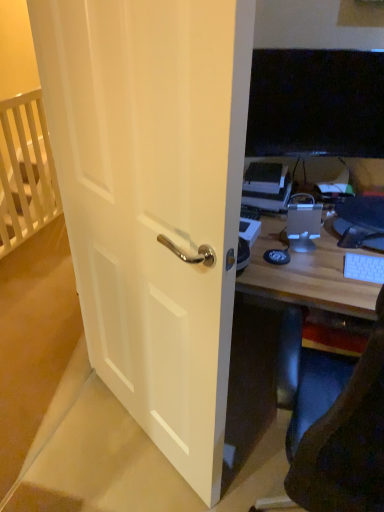
At what (x,y) coordinates should I click in order to perform the action: click on white wooden crib at upper left. Please return your answer as a coordinate pair (x, y). Image resolution: width=384 pixels, height=512 pixels. Looking at the image, I should click on (25, 170).

Image resolution: width=384 pixels, height=512 pixels. What do you see at coordinates (25, 170) in the screenshot?
I see `white wooden crib at upper left` at bounding box center [25, 170].

The image size is (384, 512). In order to click on black glossy monitor at upper right in this screenshot , I will do pyautogui.click(x=316, y=103).

Describe the element at coordinates (316, 103) in the screenshot. I see `black glossy monitor at upper right` at that location.

Where is `satin silver desktop at center`? The width and height of the screenshot is (384, 512). satin silver desktop at center is located at coordinates (303, 222).

Image resolution: width=384 pixels, height=512 pixels. In order to click on black rubber mousepad at center in this screenshot , I will do (x=277, y=256).

Can we say satin silver desktop at center lies outside white wooden crib at upper left?

satin silver desktop at center is positioned outside white wooden crib at upper left.

Identify the location of desktop computer on the right of white wooden crib at upper left. (303, 222).

From the image's perspective, which object appears higher, satin silver desktop at center or white wooden crib at upper left?

white wooden crib at upper left, from the image's perspective.

Which is more to the left, satin silver desktop at center or white wooden crib at upper left?

white wooden crib at upper left.

Considering the relative sizes of black glossy monitor at upper right and satin silver desktop at center in the image provided, is black glossy monitor at upper right bigger than satin silver desktop at center?

Yes.

Is black glossy monitor at upper right far from satin silver desktop at center?

No, black glossy monitor at upper right is not far from satin silver desktop at center.

Considering the positions of objects black glossy monitor at upper right and satin silver desktop at center in the image provided, who is behind, black glossy monitor at upper right or satin silver desktop at center?

black glossy monitor at upper right.

Is satin silver desktop at center inside black glossy monitor at upper right?

No, satin silver desktop at center is located outside of black glossy monitor at upper right.

From the image's perspective, between white wooden crib at upper left and satin silver desktop at center, who is located below?

From the image's view, satin silver desktop at center is below.

Are white wooden crib at upper left and satin silver desktop at center located far from each other?

Yes, white wooden crib at upper left is far from satin silver desktop at center.

Who is smaller, white wooden crib at upper left or satin silver desktop at center?

satin silver desktop at center.

Looking at this image, how far apart are white wooden crib at upper left and satin silver desktop at center?

white wooden crib at upper left and satin silver desktop at center are 6.43 feet apart from each other.

How distant is white plastic keyboard at right from white wooden crib at upper left?

A distance of 2.22 meters exists between white plastic keyboard at right and white wooden crib at upper left.

Is white plastic keyboard at right bigger than white wooden crib at upper left?

No.

From the image's perspective, which one is positioned higher, white plastic keyboard at right or white wooden crib at upper left?

white wooden crib at upper left.

Is white plastic keyboard at right far from white wooden crib at upper left?

Yes, white plastic keyboard at right and white wooden crib at upper left are quite far apart.

Image resolution: width=384 pixels, height=512 pixels. In order to click on mousepad that appears below the white matte door at center (from a real-world perspective) in this screenshot , I will do `click(277, 256)`.

Is the depth of black rubber mousepad at center less than that of white matte door at center?

No, black rubber mousepad at center is behind white matte door at center.

Based on their sizes in the image, would you say black rubber mousepad at center is bigger or smaller than white matte door at center?

Clearly, black rubber mousepad at center is smaller in size than white matte door at center.

Looking at this image, considering the relative sizes of white plastic keyboard at right and black rubber mousepad at center in the image provided, is white plastic keyboard at right shorter than black rubber mousepad at center?

In fact, white plastic keyboard at right may be taller than black rubber mousepad at center.

Does white plastic keyboard at right appear on the right side of black rubber mousepad at center?

Indeed, white plastic keyboard at right is positioned on the right side of black rubber mousepad at center.

Is white plastic keyboard at right looking in the opposite direction of black rubber mousepad at center?

white plastic keyboard at right does not have its back to black rubber mousepad at center.

How different are the orientations of white plastic keyboard at right and black rubber mousepad at center in degrees?

The facing directions of white plastic keyboard at right and black rubber mousepad at center are 2.47 degrees apart.

Considering the sizes of objects white matte door at center and white plastic keyboard at right in the image provided, who is thinner, white matte door at center or white plastic keyboard at right?

white matte door at center.

Is white matte door at center located outside white plastic keyboard at right?

Indeed, white matte door at center is completely outside white plastic keyboard at right.

From the picture: In the image, is white matte door at center positioned in front of or behind white plastic keyboard at right?

In the image, white matte door at center appears in front of white plastic keyboard at right.

Is white matte door at center taller than white plastic keyboard at right?

Yes.

The width and height of the screenshot is (384, 512). I want to click on desktop computer below the white wooden crib at upper left (from the image's perspective), so click(303, 222).

Find the location of `television above the satin silver desktop at center (from the image's perspective)`. television above the satin silver desktop at center (from the image's perspective) is located at coordinates coord(316,103).

Based on their spatial positions, is white matte door at center or black glossy monitor at upper right closer to black rubber mousepad at center?

black glossy monitor at upper right.

Which object lies nearer to the anchor point black rubber mousepad at center, white matte door at center or white plastic keyboard at right?

white plastic keyboard at right is closer to black rubber mousepad at center.

Based on their spatial positions, is white plastic keyboard at right or black rubber mousepad at center closer to white wooden crib at upper left?

black rubber mousepad at center lies closer to white wooden crib at upper left than the other object.

Which object lies nearer to the anchor point satin silver desktop at center, white wooden crib at upper left or white plastic keyboard at right?

Among the two, white plastic keyboard at right is located nearer to satin silver desktop at center.

Which object lies further to the anchor point white wooden crib at upper left, black rubber mousepad at center or white plastic keyboard at right?

Among the two, white plastic keyboard at right is located further to white wooden crib at upper left.

From the image, which object appears to be farther from white matte door at center, white wooden crib at upper left or satin silver desktop at center?

Among the two, white wooden crib at upper left is located further to white matte door at center.

When comparing their distances from black glossy monitor at upper right, does white wooden crib at upper left or black rubber mousepad at center seem further?

white wooden crib at upper left is further to black glossy monitor at upper right.

When comparing their distances from satin silver desktop at center, does white matte door at center or black glossy monitor at upper right seem closer?

Among the two, black glossy monitor at upper right is located nearer to satin silver desktop at center.

You are a GUI agent. You are given a task and a screenshot of the screen. Output one action in this format:
    pyautogui.click(x=<x>, y=<y>)
    Task: Click on the mousepad situated between white matte door at center and white plastic keyboard at right from left to right
    The image size is (384, 512).
    Given the screenshot: What is the action you would take?
    pyautogui.click(x=277, y=256)

This screenshot has height=512, width=384. Identify the location of desktop computer that lies between black glossy monitor at upper right and white plastic keyboard at right from top to bottom. (303, 222).

Find the location of `desktop computer between white matte door at center and white plastic keyboard at right from left to right`. desktop computer between white matte door at center and white plastic keyboard at right from left to right is located at coordinates (303, 222).

At what (x,y) coordinates should I click in order to perform the action: click on mousepad between white wooden crib at upper left and satin silver desktop at center. Please return your answer as a coordinate pair (x, y). The width and height of the screenshot is (384, 512). Looking at the image, I should click on point(277,256).